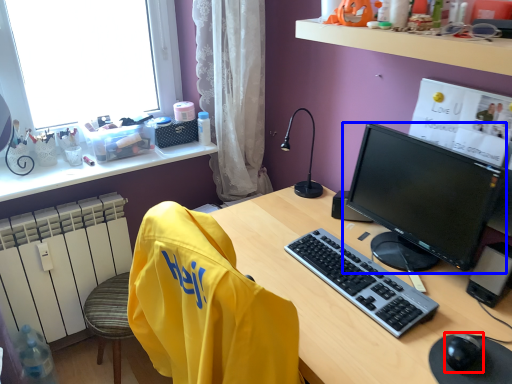
Question: Among these objects, which one is farthest to the camera, mouse (highlighted by a red box) or computer monitor (highlighted by a blue box)?

Choices:
 (A) mouse
 (B) computer monitor

Answer: (B)